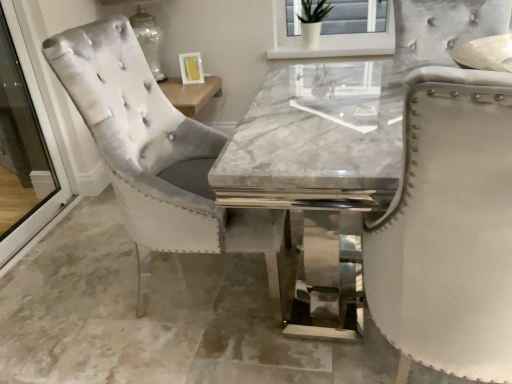
Question: From the image's perspective, is clear glass screen door at left on velvet chair at left?

Choices:
 (A) no
 (B) yes

Answer: (B)

Question: Considering the relative sizes of clear glass screen door at left and velvet chair at left in the image provided, is clear glass screen door at left smaller than velvet chair at left?

Choices:
 (A) no
 (B) yes

Answer: (B)

Question: Is clear glass screen door at left positioned with its back to velvet chair at left?

Choices:
 (A) yes
 (B) no

Answer: (B)

Question: Can you confirm if clear glass screen door at left is taller than velvet chair at left?

Choices:
 (A) yes
 (B) no

Answer: (A)

Question: Is clear glass screen door at left bigger than velvet chair at left?

Choices:
 (A) no
 (B) yes

Answer: (A)

Question: Is clear glass screen door at left to the left of velvet chair at left from the viewer's perspective?

Choices:
 (A) no
 (B) yes

Answer: (B)

Question: From the image's perspective, is velvet chair at left above clear glass screen door at left?

Choices:
 (A) yes
 (B) no

Answer: (B)

Question: Is velvet chair at left positioned before clear glass screen door at left?

Choices:
 (A) yes
 (B) no

Answer: (A)

Question: Considering the relative positions of velvet chair at left and clear glass screen door at left in the image provided, is velvet chair at left to the left of clear glass screen door at left from the viewer's perspective?

Choices:
 (A) no
 (B) yes

Answer: (A)

Question: Does velvet chair at left appear on the right side of clear glass screen door at left?

Choices:
 (A) yes
 (B) no

Answer: (A)

Question: From a real-world perspective, is velvet chair at left over clear glass screen door at left?

Choices:
 (A) no
 (B) yes

Answer: (A)

Question: Does velvet chair at left contain clear glass screen door at left?

Choices:
 (A) no
 (B) yes

Answer: (A)

Question: In terms of height, does velvet chair at left look taller or shorter compared to clear glass screen door at left?

Choices:
 (A) short
 (B) tall

Answer: (A)